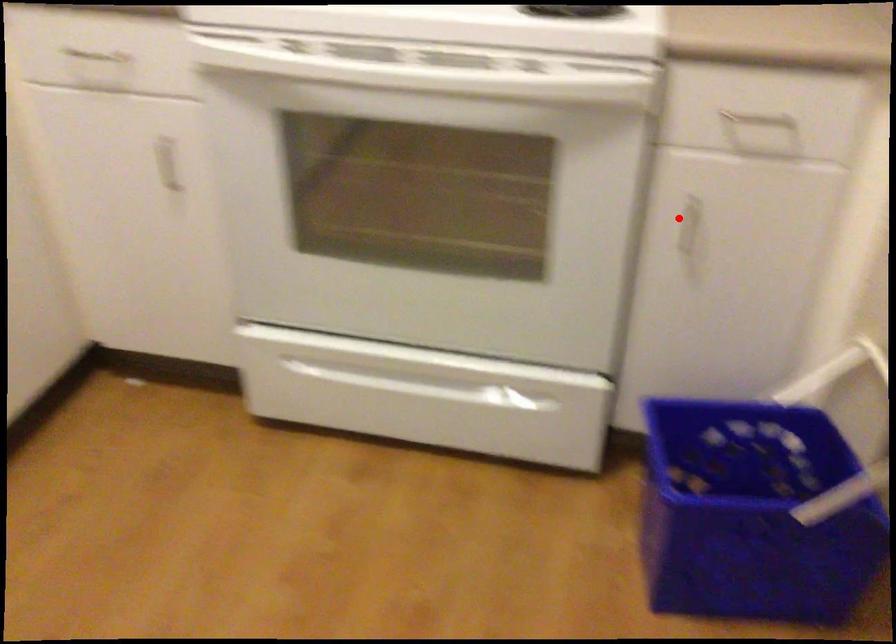
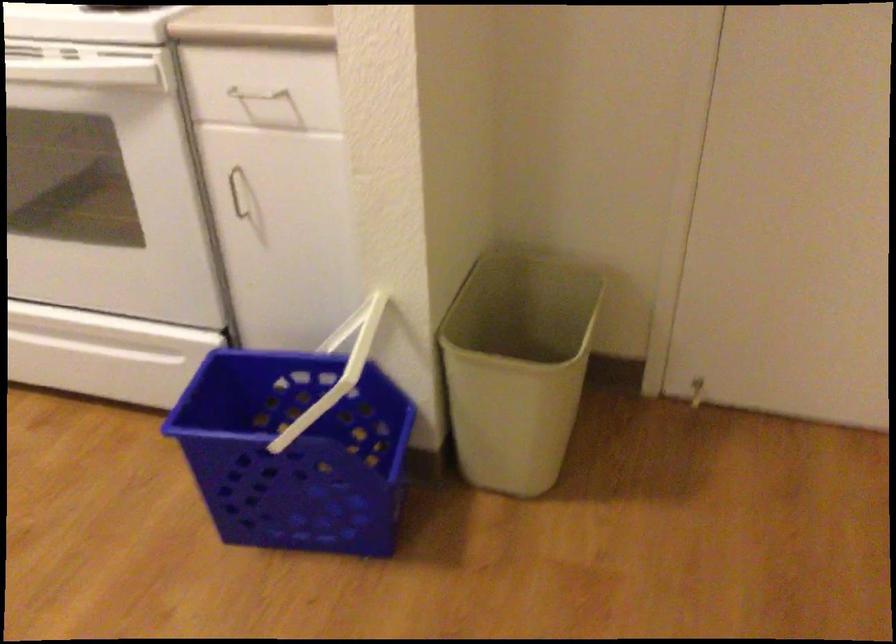
Question: I am providing you with two images of the same scene from different viewpoints. Given a red point in image1, look at the same physical point in image2. Is it:

Choices:
 (A) Closer to the viewpoint
 (B) Farther from the viewpoint

Answer: (B)